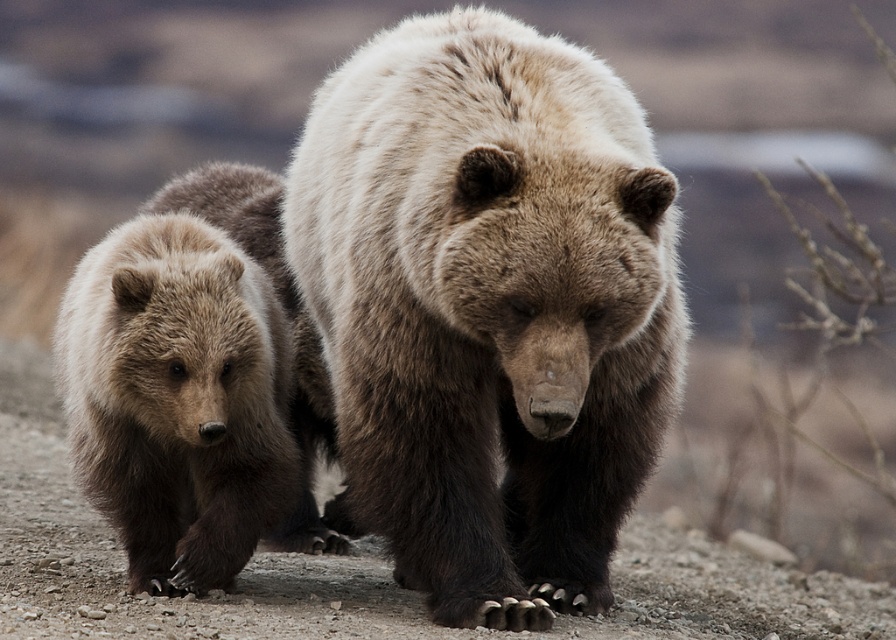
Question: Which object appears farthest from the camera in this image?

Choices:
 (A) fuzzy brown bear at left
 (B) fuzzy brown bear at center

Answer: (A)

Question: Can you confirm if fuzzy brown bear at center is bigger than fuzzy brown bear at left?

Choices:
 (A) yes
 (B) no

Answer: (A)

Question: Does fuzzy brown bear at center have a larger size compared to fuzzy brown bear at left?

Choices:
 (A) yes
 (B) no

Answer: (A)

Question: Which point is farther to the camera?

Choices:
 (A) fuzzy brown bear at center
 (B) fuzzy brown bear at left

Answer: (B)

Question: Is the position of fuzzy brown bear at center more distant than that of fuzzy brown bear at left?

Choices:
 (A) no
 (B) yes

Answer: (A)